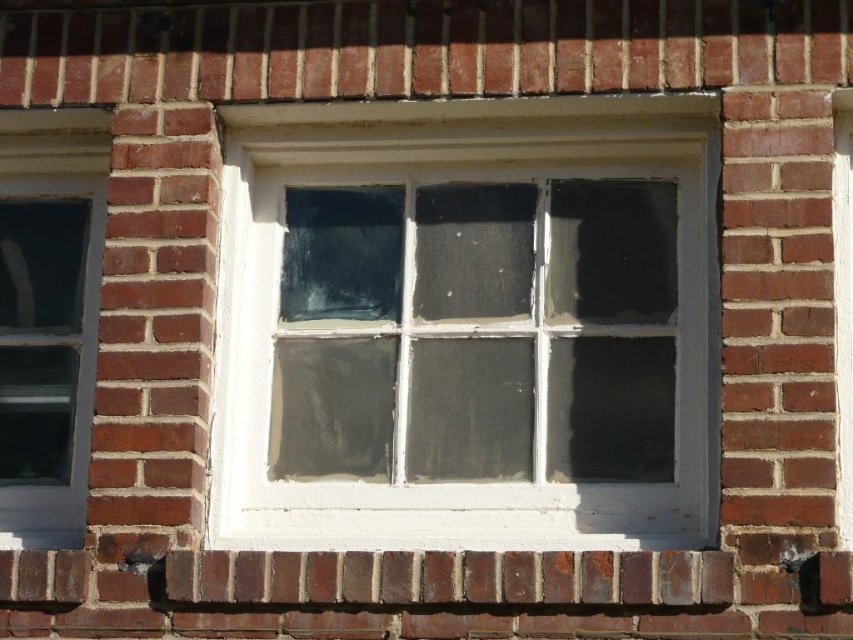
Is white painted wood window frame at center below clear glass window at left?

Incorrect, white painted wood window frame at center is not positioned below clear glass window at left.

Is white painted wood window frame at center thinner than clear glass window at left?

Incorrect, white painted wood window frame at center's width is not less than clear glass window at left's.

This screenshot has height=640, width=853. Describe the element at coordinates (467, 324) in the screenshot. I see `white painted wood window frame at center` at that location.

Locate an element on the screen. white painted wood window frame at center is located at coordinates click(x=467, y=324).